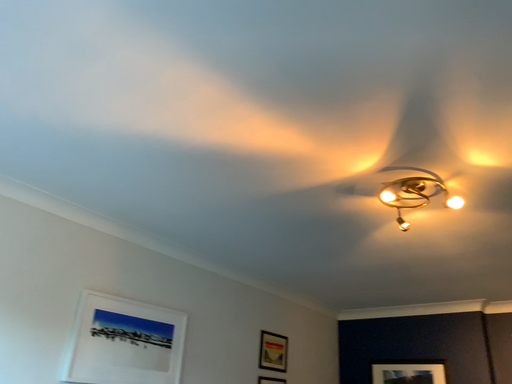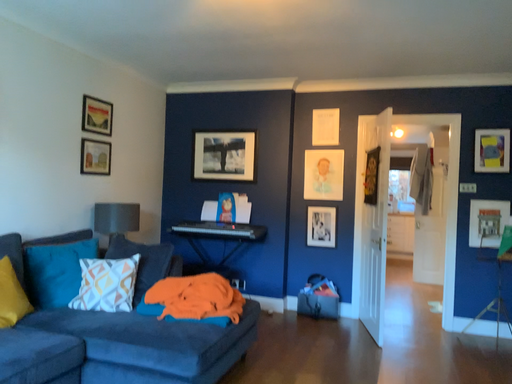
Question: How did the camera likely rotate when shooting the video?

Choices:
 (A) rotated left
 (B) rotated right

Answer: (B)